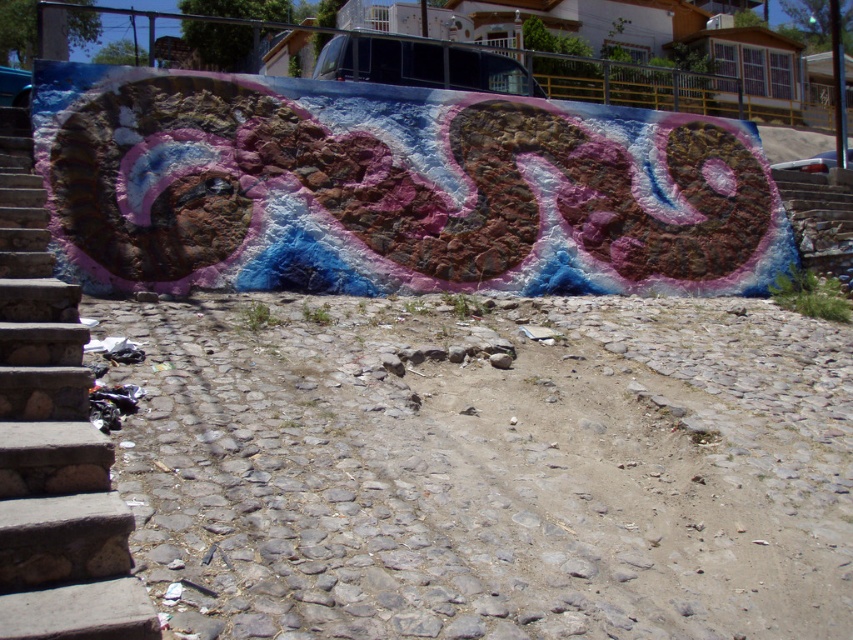
You are a delivery person carrying a heavy package and need to reach the wall with the street art. You see the dirt track at lower center and the stone stairs at left. Which path is more suitable for moving heavy items?

The dirt track at lower center is more suitable for moving heavy items because it is positioned under the stone stairs at left, making it a flatter and wider path compared to the stairs.

You are a delivery person trying to decide between taking the dirt track at lower center or the stone stairs at left to reach the wall. Which path would require less physical effort?

The dirt track at lower center occupies less space than the stone stairs at left, so taking the dirt track at lower center would likely require less physical effort as it is shorter and may be flatter compared to the stairs.